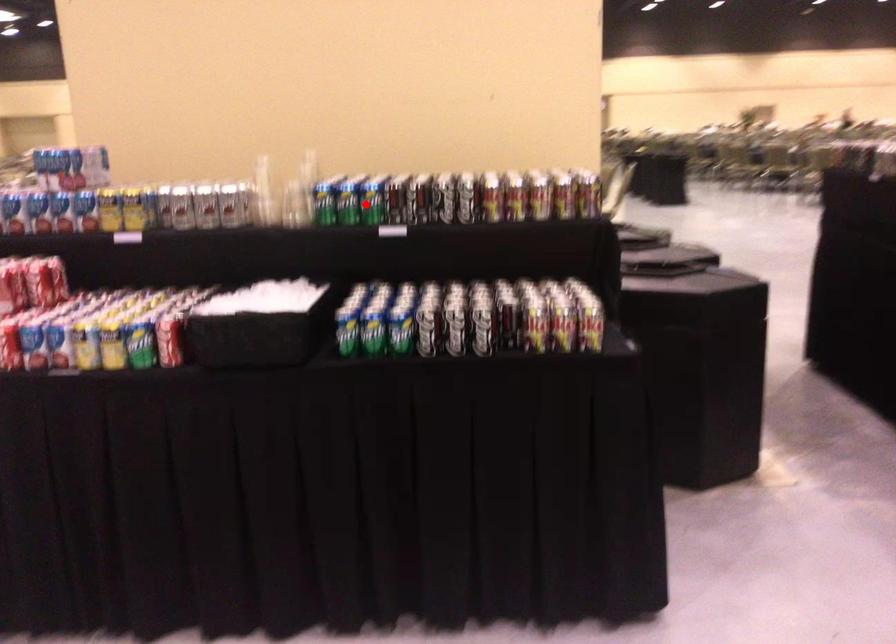
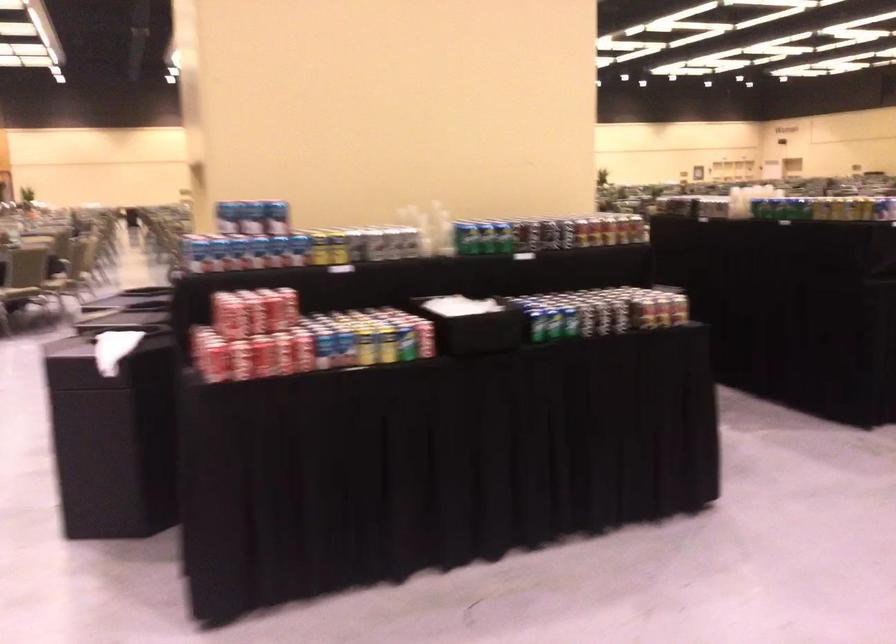
The point at the highlighted location is marked in the first image. Where is the corresponding point in the second image?

(504, 237)